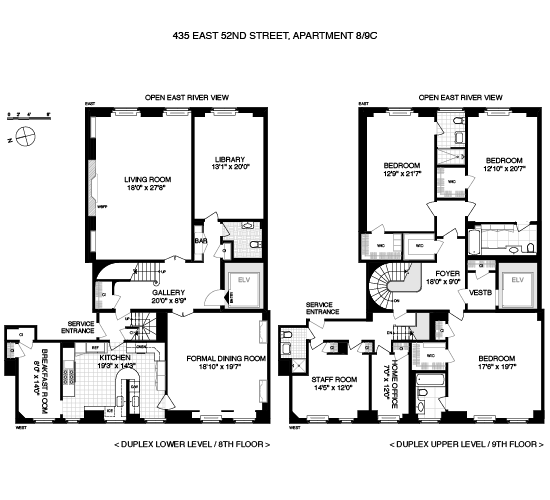
Where is `kitchen area`? The image size is (550, 500). kitchen area is located at coordinates tap(110, 367).